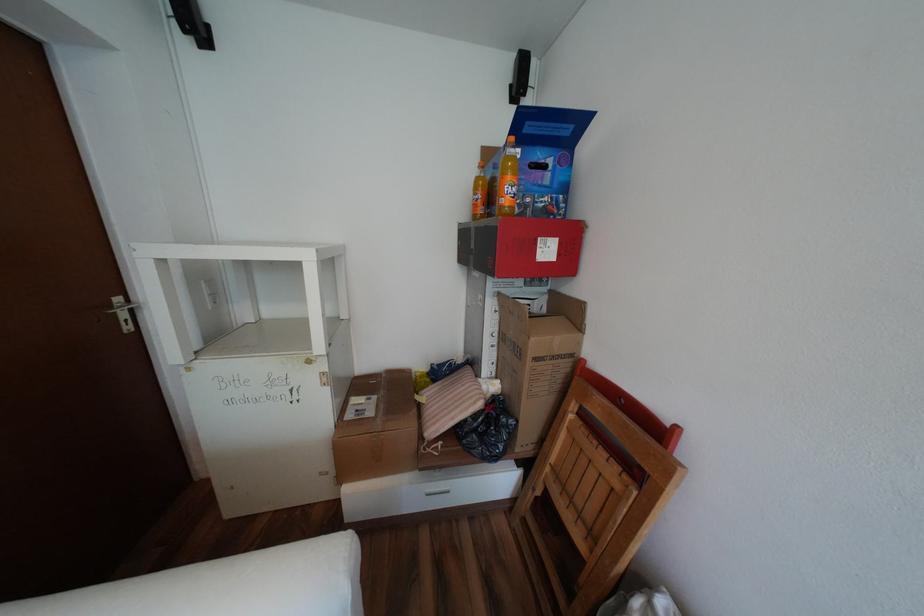
The image size is (924, 616). What are the coordinates of `white drawer handle` in the screenshot? It's located at (439, 493).